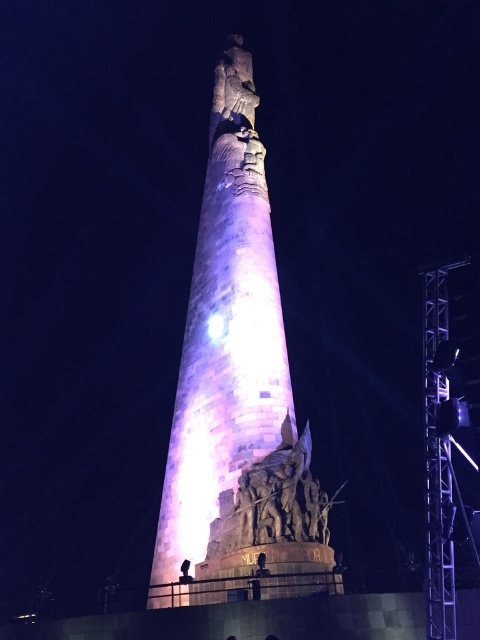
Which is more to the right, purple stone tower at center or stone sculpture at lower center?

Positioned to the right is stone sculpture at lower center.

Is purple stone tower at center to the left of stone sculpture at lower center from the viewer's perspective?

Yes, purple stone tower at center is to the left of stone sculpture at lower center.

Find the location of a particular element. This screenshot has height=640, width=480. purple stone tower at center is located at coordinates (238, 390).

Where is `purple stone tower at center`? This screenshot has height=640, width=480. purple stone tower at center is located at coordinates (238, 390).

Can you confirm if stone sculpture at lower center is smaller than metallic scaffolding at right?

Indeed, stone sculpture at lower center has a smaller size compared to metallic scaffolding at right.

Is stone sculpture at lower center shorter than metallic scaffolding at right?

Yes, stone sculpture at lower center is shorter than metallic scaffolding at right.

Is point (239, 548) less distant than point (469, 300)?

No, it is not.

This screenshot has height=640, width=480. Find the location of `stone sculpture at lower center`. stone sculpture at lower center is located at coordinates (272, 525).

Which is behind, point (188, 426) or point (433, 344)?

Positioned behind is point (188, 426).

Locate an element on the screen. This screenshot has width=480, height=640. purple stone tower at center is located at coordinates (238, 390).